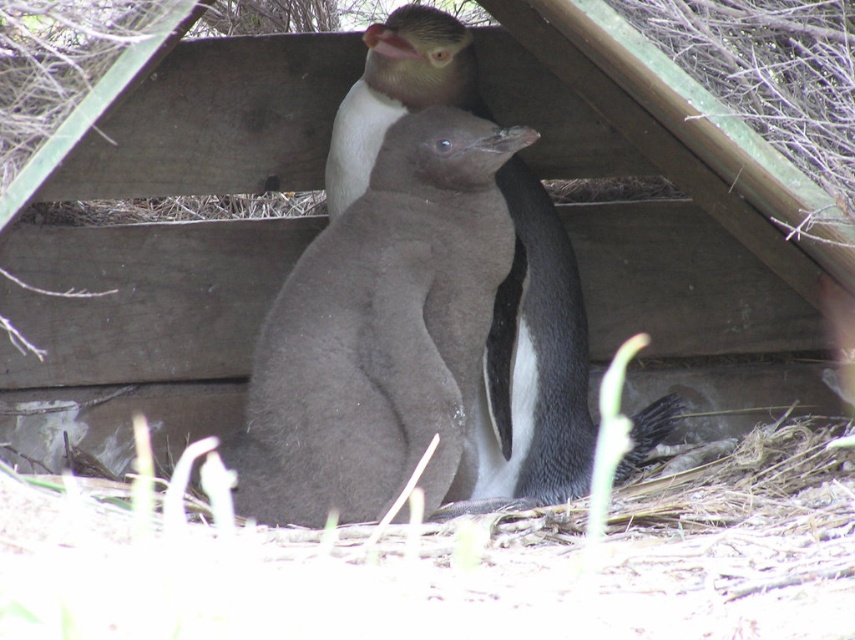
Does dark gray downy penguin at center appear on the left side of dark gray feathers at center?

Indeed, dark gray downy penguin at center is positioned on the left side of dark gray feathers at center.

Measure the distance from dark gray downy penguin at center to dark gray feathers at center.

dark gray downy penguin at center is 27.12 centimeters from dark gray feathers at center.

Is point (525, 144) positioned before point (547, 324)?

That is True.

Identify the location of dark gray downy penguin at center. The width and height of the screenshot is (855, 640). tap(381, 333).